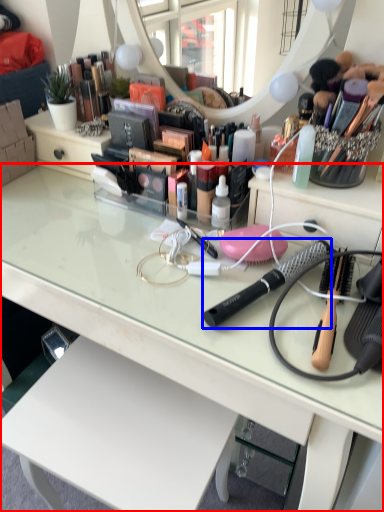
Question: Which of the following is the closest to the observer, desk (highlighted by a red box) or brush (highlighted by a blue box)?

Choices:
 (A) desk
 (B) brush

Answer: (A)